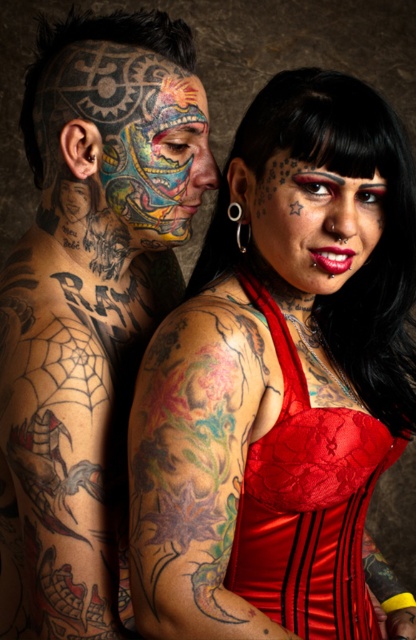
You are a photographer trying to capture a closeup shot of both the shiny red lipstick at center and the colorful tattooed face at center. Given that your camera has a depth of field that can focus on objects within 12 centimeters of each other, will both subjects be in focus?

The shiny red lipstick at center is 12.57 centimeters away from the colorful tattooed face at center. Since the distance between them exceeds the camera lens depth of field range of 12 centimeters, the two subjects cannot be in focus simultaneously.

You are a photographer setting up a shoot. You need to adjust the lighting so that the multicolored tattooed face at center and the red satin dress at center are both well illuminated. Given their sizes, which object should you focus the light on first to ensure proper exposure?

The multicolored tattooed face at center is much taller than the red satin dress at center, so you should focus the light on the multicolored tattooed face at center first to ensure proper exposure.

You are a photographer preparing to take a portrait of the two people in the image. You need to ensure that the matte red lace dress at center and the shiny red lipstick at center are both clearly visible in the frame. Considering their sizes, which object should you focus on to ensure both are in focus?

The matte red lace dress at center is wider than the shiny red lipstick at center. To ensure both are in focus, you should focus on the matte red lace dress at center since it is larger and will require more attention to capture details.